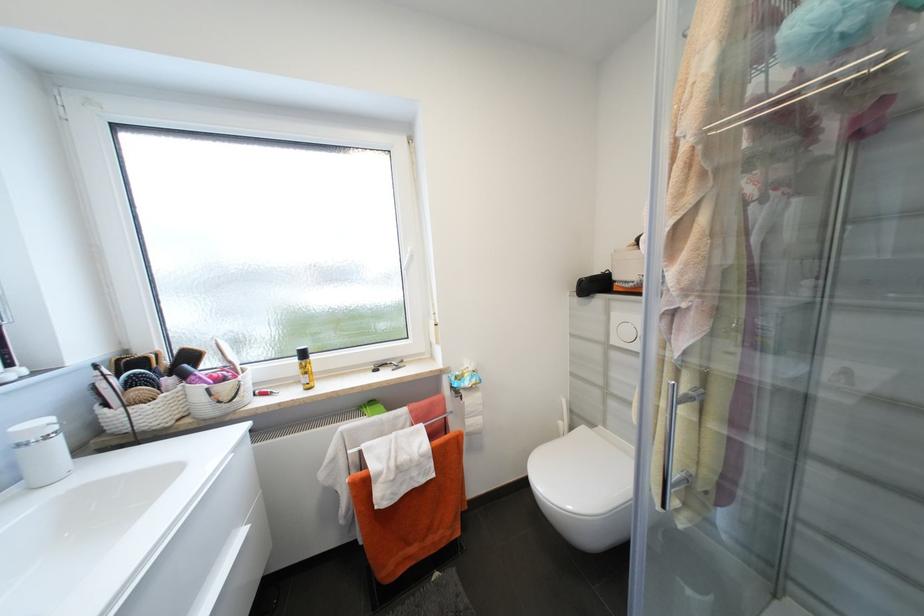
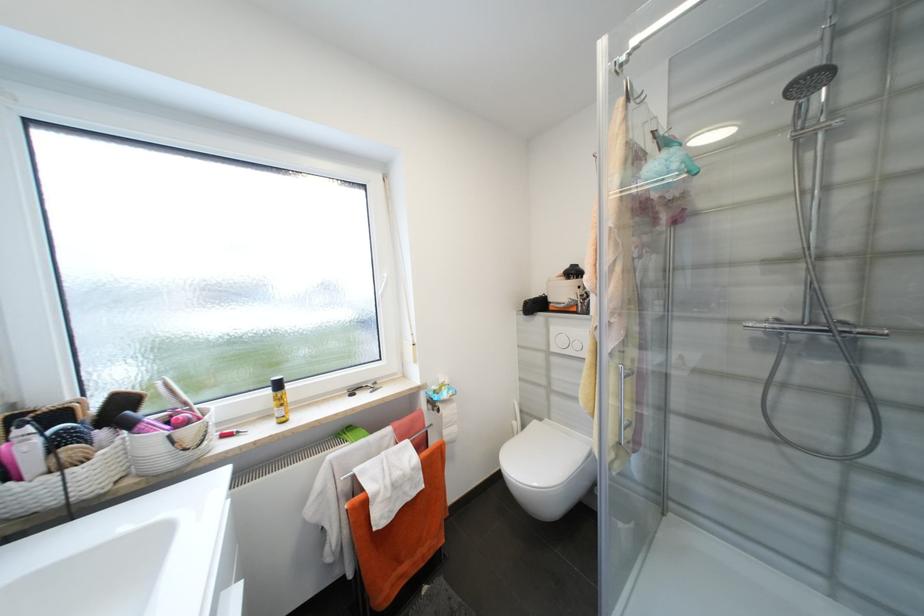
The point at (468,399) is marked in the first image. Where is the corresponding point in the second image?

(444, 411)